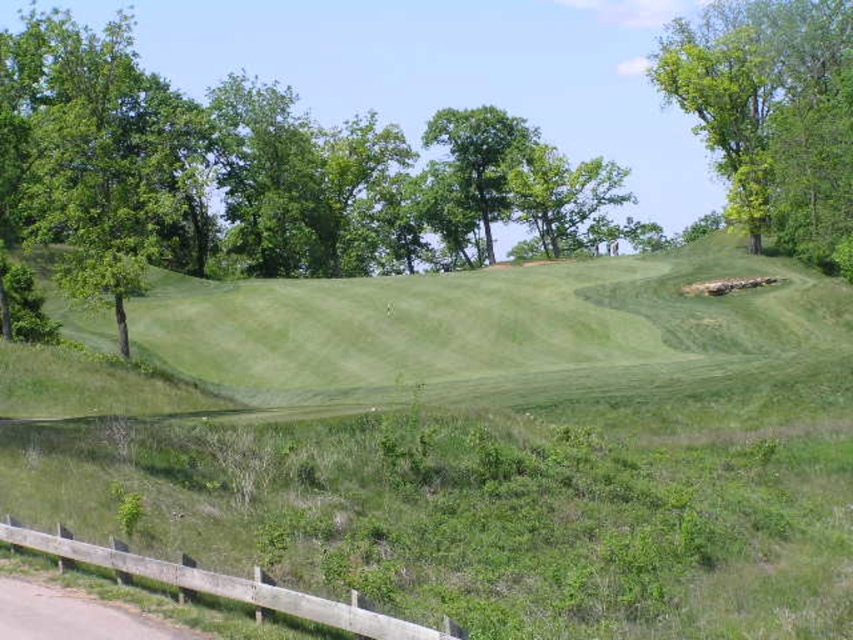
Between green grassy hill at center and green leafy tree at center, which one appears on the right side from the viewer's perspective?

Positioned to the right is green leafy tree at center.

What do you see at coordinates (476, 444) in the screenshot? The width and height of the screenshot is (853, 640). I see `green grassy hill at center` at bounding box center [476, 444].

Which is behind, point (850, 321) or point (509, 140)?

The point (509, 140) is more distant.

You are a GUI agent. You are given a task and a screenshot of the screen. Output one action in this format:
    pyautogui.click(x=<x>, y=<y>)
    Task: Click on the green grassy hill at center
    Image resolution: width=853 pixels, height=640 pixels.
    Given the screenshot: What is the action you would take?
    pyautogui.click(x=476, y=444)

Does green leafy tree at left have a greater height compared to green leafy tree at upper right?

Correct, green leafy tree at left is much taller as green leafy tree at upper right.

Between point (3, 212) and point (743, 115), which one is positioned behind?

The point (743, 115) is more distant.

Who is more forward, (193, 177) or (831, 173)?

Point (831, 173)

The image size is (853, 640). Find the location of `green leafy tree at left`. green leafy tree at left is located at coordinates (96, 154).

Is green grassy hill at center further to the viewer compared to green leafy tree at upper right?

That is False.

Does point (328, 360) lie behind point (801, 237)?

No, (328, 360) is closer to viewer.

Is point (210, 408) more distant than point (843, 4)?

That is False.

You are a GUI agent. You are given a task and a screenshot of the screen. Output one action in this format:
    pyautogui.click(x=<x>, y=<y>)
    Task: Click on the green grassy hill at center
    The height and width of the screenshot is (640, 853).
    Given the screenshot: What is the action you would take?
    pyautogui.click(x=476, y=444)